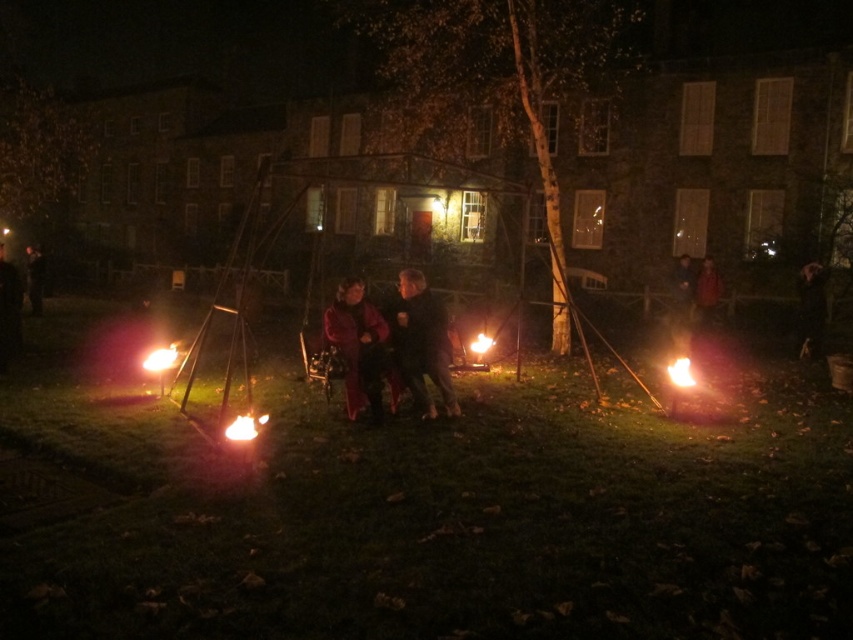
Is dark brown leather jacket at right to the left of flamered-orangefire at lower center from the viewer's perspective?

Incorrect, dark brown leather jacket at right is not on the left side of flamered-orangefire at lower center.

Is dark brown leather jacket at right shorter than flamered-orangefire at lower center?

Incorrect, dark brown leather jacket at right's height does not fall short of flamered-orangefire at lower center's.

Which is behind, point (704, 291) or point (252, 417)?

The point (704, 291) is more distant.

Identify the location of dark brown leather jacket at right. (706, 292).

Which of these two, smooth leather jacket at right or dark brown leather jacket at right, stands shorter?

dark brown leather jacket at right

Is point (805, 312) positioned in front of point (699, 298)?

Yes, point (805, 312) is closer to viewer.

Who is more distant from viewer, (802, 316) or (706, 284)?

Positioned behind is point (706, 284).

At what (x,y) coordinates should I click in order to perform the action: click on smooth leather jacket at right. Please return your answer as a coordinate pair (x, y). Image resolution: width=853 pixels, height=640 pixels. Looking at the image, I should click on (811, 308).

Who is more distant from viewer, (6, 285) or (41, 272)?

The point (41, 272) is behind.

Does point (6, 356) come behind point (32, 292)?

No, (6, 356) is in front of (32, 292).

Is point (13, 355) positioned after point (38, 246)?

No, (13, 355) is closer to viewer.

I want to click on matte black coat at center, so click(9, 310).